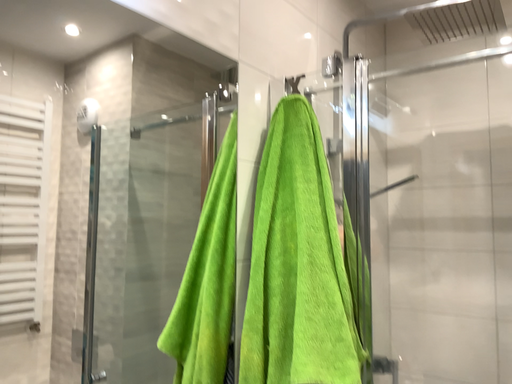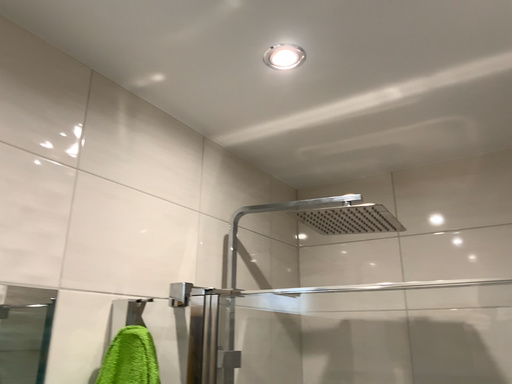
Question: Which way did the camera rotate in the video?

Choices:
 (A) rotated upward
 (B) rotated downward

Answer: (A)